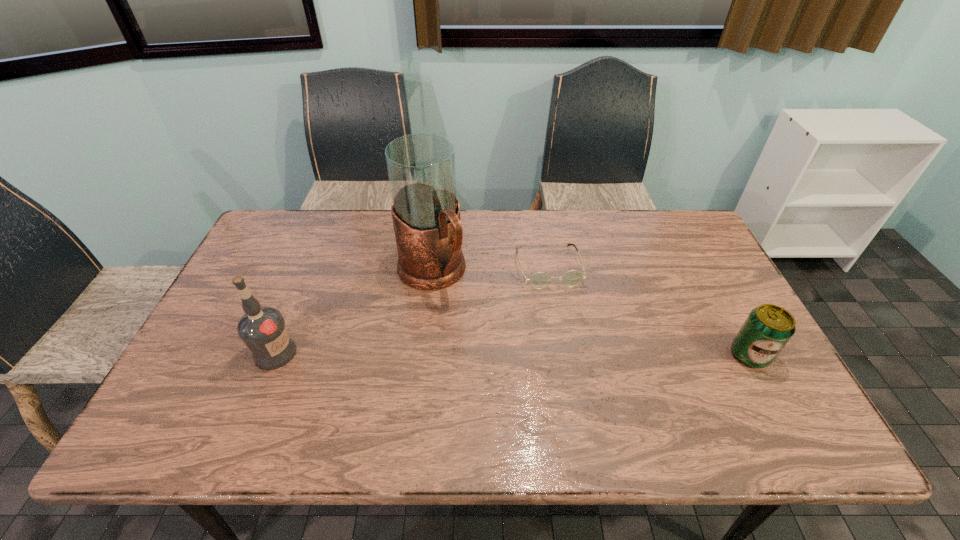
The width and height of the screenshot is (960, 540). Identify the location of free spot between the second tallest object and the pitcher. (353, 313).

Locate an element on the screen. The height and width of the screenshot is (540, 960). free space between the vodka and the shortest object is located at coordinates (412, 309).

Locate an element on the screen. The image size is (960, 540). empty space that is in between the leftmost object and the beer can is located at coordinates (513, 354).

You are a GUI agent. You are given a task and a screenshot of the screen. Output one action in this format:
    pyautogui.click(x=<x>, y=<y>)
    Task: Click on the blank region between the vodka and the second object from right to left
    The width and height of the screenshot is (960, 540).
    Given the screenshot: What is the action you would take?
    pyautogui.click(x=412, y=309)

Locate an element on the screen. The image size is (960, 540). vacant region between the pitcher and the second object from right to left is located at coordinates (490, 269).

The image size is (960, 540). Identify the location of free spot between the beer can and the leftmost object. (513, 354).

The image size is (960, 540). Find the location of `free space between the leftmost object and the third object from right to left`. free space between the leftmost object and the third object from right to left is located at coordinates (353, 313).

Locate which object is the second closest to the third shortest object. Please provide its 2D coordinates. Your answer should be formatted as a tuple, i.e. [(x, y)], where the tuple contains the x and y coordinates of a point satisfying the conditions above.

[(539, 280)]

This screenshot has width=960, height=540. I want to click on object that can be found as the third closest to the beer can, so click(x=262, y=329).

Where is `free spot that satisfies the following two spatial constraints: 1. on the front side of the rightmost object; 2. on the left side of the spectacles`? free spot that satisfies the following two spatial constraints: 1. on the front side of the rightmost object; 2. on the left side of the spectacles is located at coordinates (563, 355).